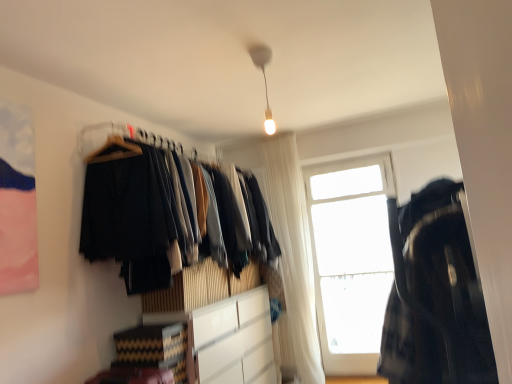
Question: Looking at their shapes, would you say white sheer curtain at center is wider or thinner than white glossy light bulb at upper center?

Choices:
 (A) wide
 (B) thin

Answer: (A)

Question: Is white sheer curtain at center to the left or to the right of white glossy light bulb at upper center in the image?

Choices:
 (A) left
 (B) right

Answer: (B)

Question: Based on their relative distances, which object is nearer to the transparent glass window at upper right?

Choices:
 (A) white glossy light bulb at upper center
 (B) dark plaid shirt at right
 (C) dark fabric clothes at left
 (D) white sheer curtain at center
 (E) white matte cabinet at center

Answer: (D)

Question: Which is farther from the transparent glass window at upper right?

Choices:
 (A) white matte cabinet at center
 (B) dark plaid shirt at right
 (C) white glossy light bulb at upper center
 (D) white sheer curtain at center
 (E) dark fabric clothes at left

Answer: (C)